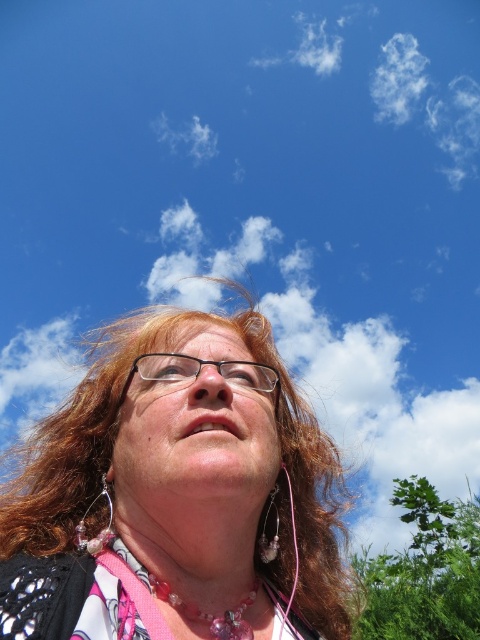
Is the position of matte black glasses at upper center more distant than that of clear plastic glasses at center?

Yes.

Is matte black glasses at upper center smaller than clear plastic glasses at center?

No.

Which is behind, point (93, 483) or point (232, 371)?

The point (93, 483) is behind.

The image size is (480, 640). What are the coordinates of `matte black glasses at upper center` in the screenshot? It's located at (177, 496).